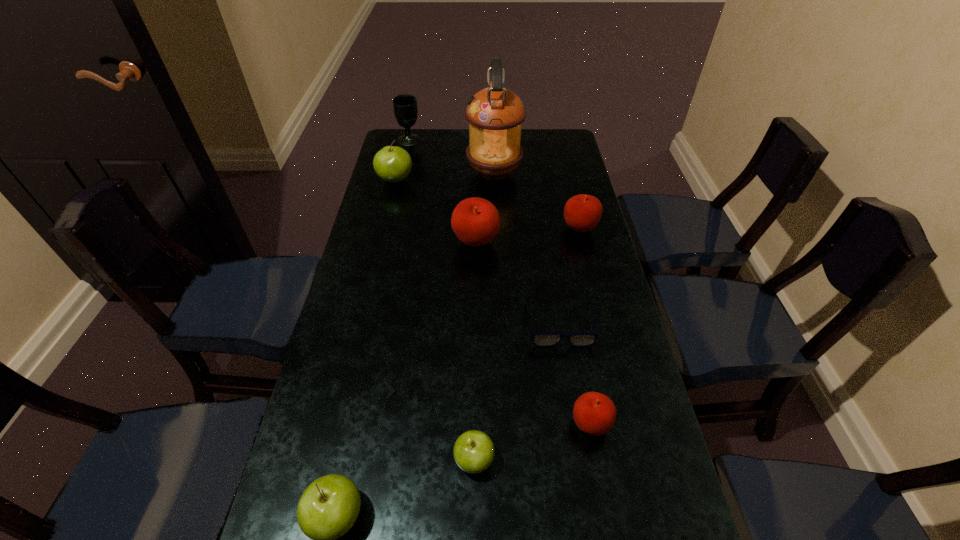
This screenshot has width=960, height=540. I want to click on chalice present at the far edge, so click(405, 108).

Locate an element on the screen. chalice that is at the left edge is located at coordinates (405, 108).

Find the location of a particular element. apple situated at the left edge is located at coordinates (393, 164).

Where is `spectacles that is positioned at the right edge`? The image size is (960, 540). spectacles that is positioned at the right edge is located at coordinates (539, 339).

Image resolution: width=960 pixels, height=540 pixels. I want to click on object at the far left corner, so click(x=405, y=108).

In the image, there is a desktop. Where is `free region at the far edge`? The height and width of the screenshot is (540, 960). free region at the far edge is located at coordinates pyautogui.click(x=460, y=140).

Where is `vacant space at the left edge of the desktop`? vacant space at the left edge of the desktop is located at coordinates (391, 270).

In the image, there is a desktop. At what (x,y) coordinates should I click in order to perform the action: click on vacant region at the right edge. Please return your answer as a coordinate pair (x, y). The image size is (960, 540). Looking at the image, I should click on (562, 323).

Find the location of `vacant space at the far left corner of the desktop`. vacant space at the far left corner of the desktop is located at coordinates (412, 152).

At what (x,y) coordinates should I click in order to perform the action: click on vacant space at the far right corner. Please return your answer as a coordinate pair (x, y). The image size is (960, 540). Looking at the image, I should click on (540, 144).